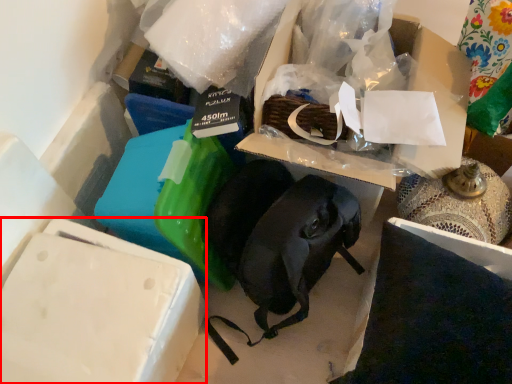
Question: From the image's perspective, where is box (annotated by the red box) located relative to storage box?

Choices:
 (A) above
 (B) below

Answer: (B)